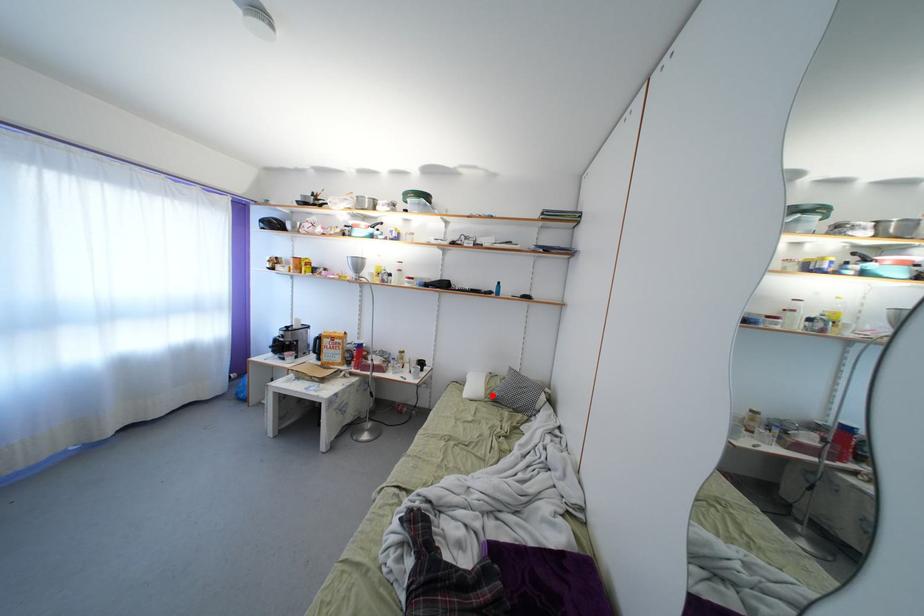
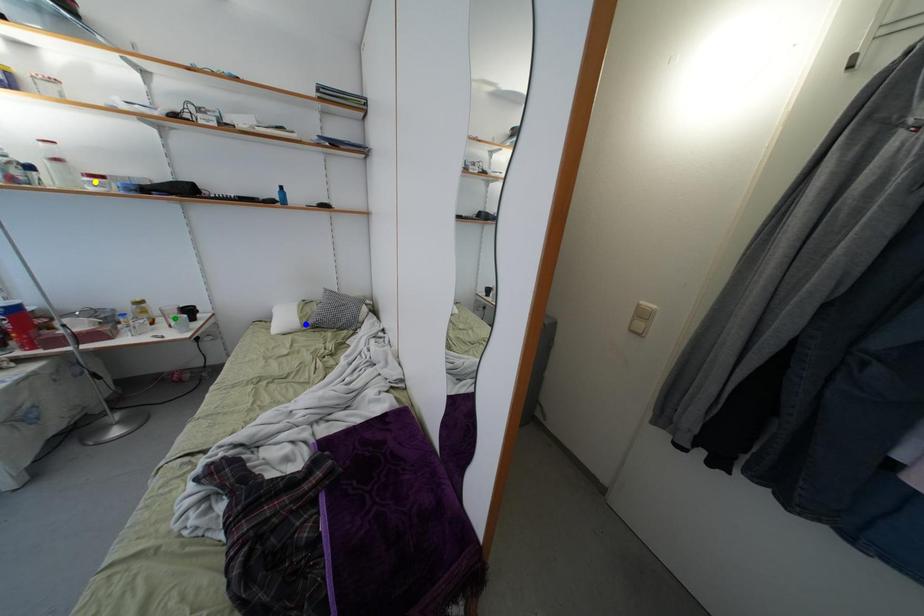
Question: I am providing you with two images of the same scene from different viewpoints. A red point is marked on the first image. You are given multiple points on the second image. In image 2, which mark is for the same physical point as the one in image 1?

Choices:
 (A) blue point
 (B) green point
 (C) yellow point

Answer: (A)